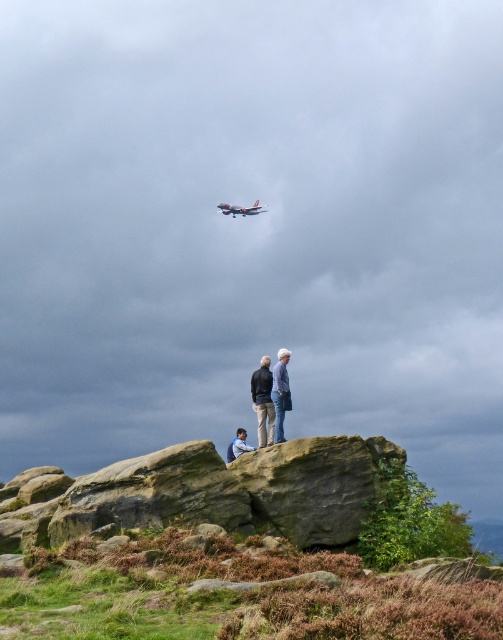
Question: Can you confirm if silver metallic airplane at upper center is wider than blue denim jacket at lower center?

Choices:
 (A) yes
 (B) no

Answer: (A)

Question: Which of these objects is positioned closest to the light blue denim jacket at center?

Choices:
 (A) light blue denim jeans at center
 (B) green mossy rock at center
 (C) silver metallic airplane at upper center

Answer: (A)

Question: Is light blue denim jeans at center smaller than silver metallic airplane at upper center?

Choices:
 (A) no
 (B) yes

Answer: (A)

Question: Which object is farther from the camera taking this photo?

Choices:
 (A) silver metallic airplane at upper center
 (B) green mossy rock at center
 (C) blue denim jacket at lower center

Answer: (A)

Question: Does green mossy rock at center appear under silver metallic airplane at upper center?

Choices:
 (A) yes
 (B) no

Answer: (A)

Question: Estimate the real-world distances between objects in this image. Which object is closer to the green mossy rock at center?

Choices:
 (A) silver metallic airplane at upper center
 (B) light blue denim jeans at center
 (C) blue denim jacket at lower center

Answer: (B)